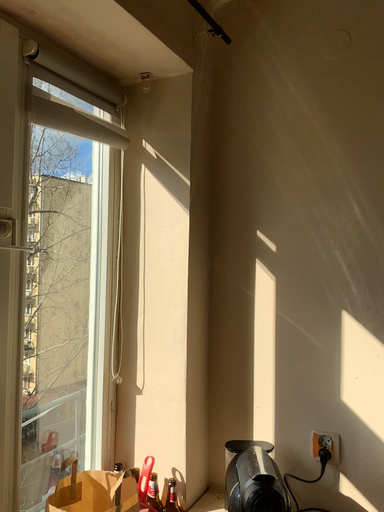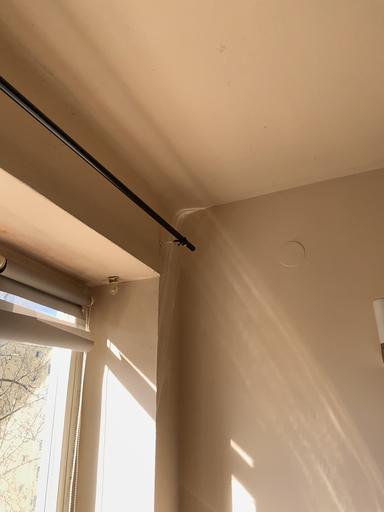
Question: How did the camera likely rotate when shooting the video?

Choices:
 (A) rotated upward
 (B) rotated downward

Answer: (A)